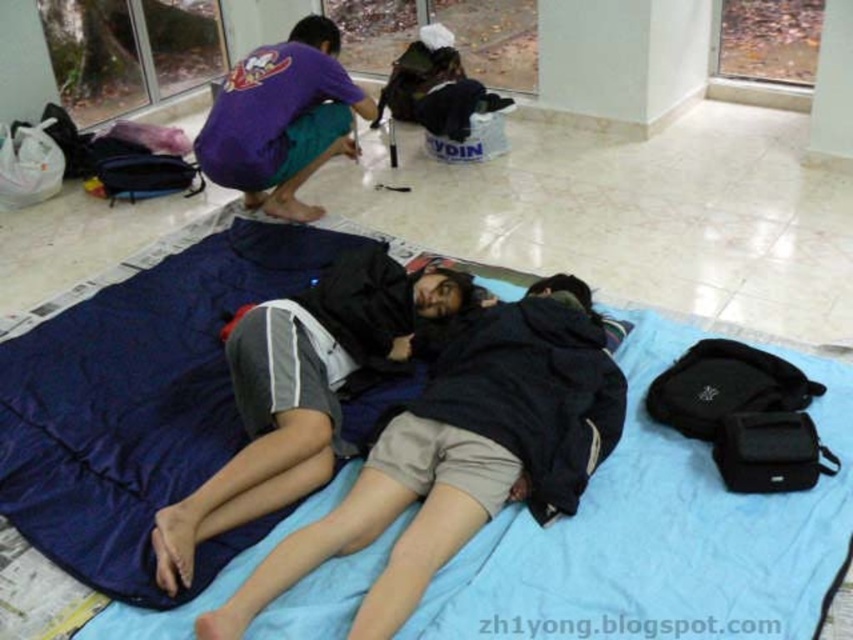
Between black fleece jacket at center and purple cotton t-shirt at upper left, which one is positioned lower?

black fleece jacket at center is below.

Can you confirm if black fleece jacket at center is smaller than purple cotton t-shirt at upper left?

Incorrect, black fleece jacket at center is not smaller in size than purple cotton t-shirt at upper left.

Is point (374, 598) positioned after point (299, 48)?

No, it is in front of (299, 48).

This screenshot has height=640, width=853. What are the coordinates of `black fleece jacket at center` in the screenshot? It's located at (463, 452).

Which is behind, point (311, 138) or point (3, 595)?

Positioned behind is point (311, 138).

Is point (254, 168) less distant than point (51, 588)?

No, it is not.

Image resolution: width=853 pixels, height=640 pixels. I want to click on purple cotton t-shirt at upper left, so click(x=282, y=120).

Can you confirm if black fleece jacket at center is taller than blue fabric mat at lower center?

Correct, black fleece jacket at center is much taller as blue fabric mat at lower center.

Locate an element on the screen. The height and width of the screenshot is (640, 853). black fleece jacket at center is located at coordinates (463, 452).

Identify the location of black fleece jacket at center. [463, 452].